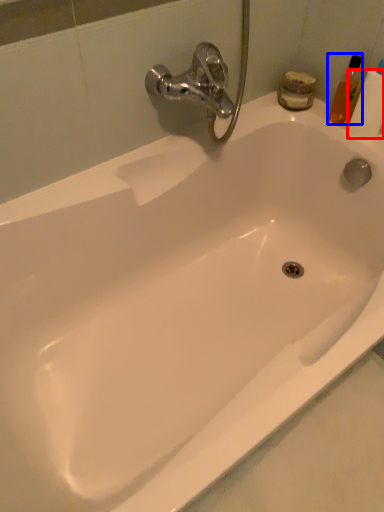
Question: Which object is closer to the camera taking this photo, toilet paper (highlighted by a red box) or toiletry (highlighted by a blue box)?

Choices:
 (A) toilet paper
 (B) toiletry

Answer: (A)